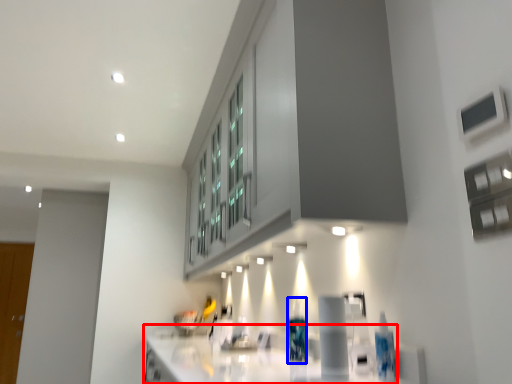
Question: Which object appears farthest to the camera in this image, countertop (highlighted by a red box) or bottle (highlighted by a blue box)?

Choices:
 (A) countertop
 (B) bottle

Answer: (B)